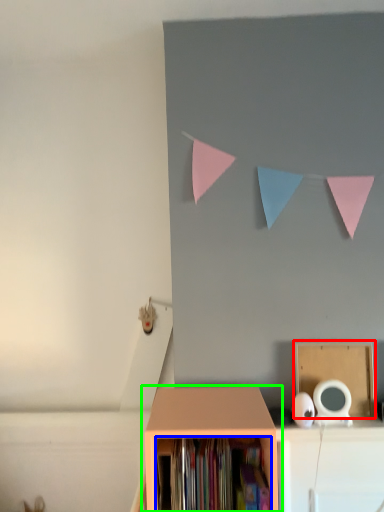
Question: Considering the real-world distances, which object is farthest from cardboard box (highlighted by a red box)? book (highlighted by a blue box) or shelf (highlighted by a green box)?

Choices:
 (A) book
 (B) shelf

Answer: (A)